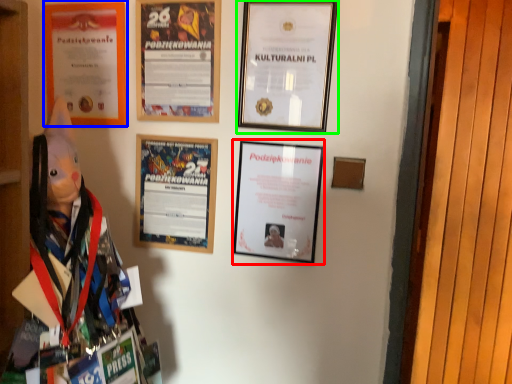
Question: Which object is positioned farthest from picture frame (highlighted by a red box)? Select from picture frame (highlighted by a blue box) and picture frame (highlighted by a green box).

Choices:
 (A) picture frame
 (B) picture frame

Answer: (A)